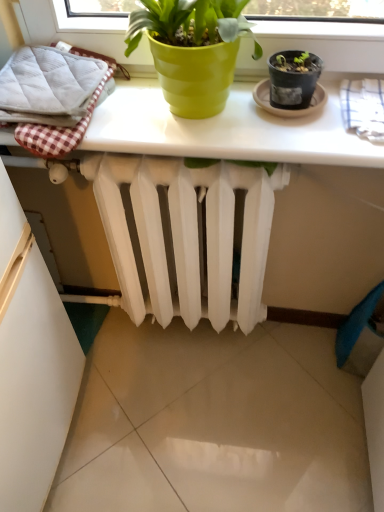
Locate an element on the screen. This screenshot has width=384, height=512. vacant space in white checkered bath towel at upper right, positioned as the first bath towel in right-to-left order (from a real-world perspective) is located at coordinates (314, 338).